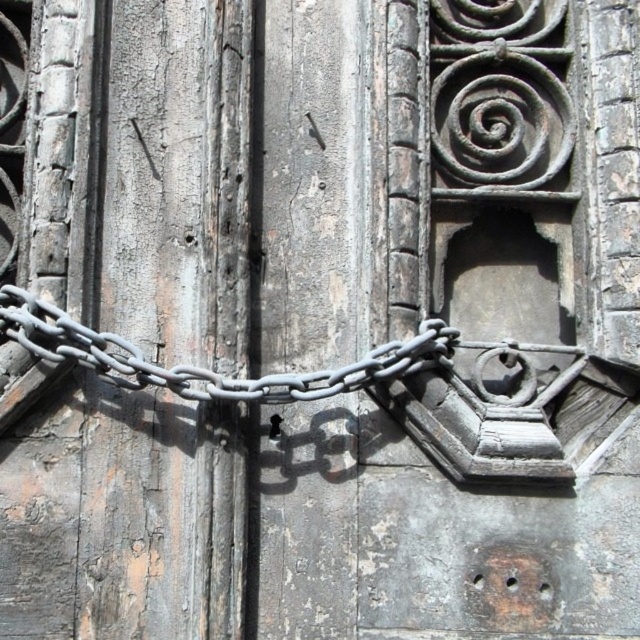
You are a locksmith trying to replace the padlock on the door. The new padlock you have is 2 inches wider than the old one. Given the distance between the gray metallic chain at center and the black matte padlock at center, will there be enough space to install the new padlock?

The gray metallic chain at center is 18.56 inches from the black matte padlock at center. The new padlock is only 2 inches wider than the old one, so there should be sufficient space to install it without any issues.

You are trying to open the door but the gray metallic chain at center and the black matte padlock at center are blocking your way. Which object is closer to you?

The gray metallic chain at center is closer to you because it is in front of the black matte padlock at center.